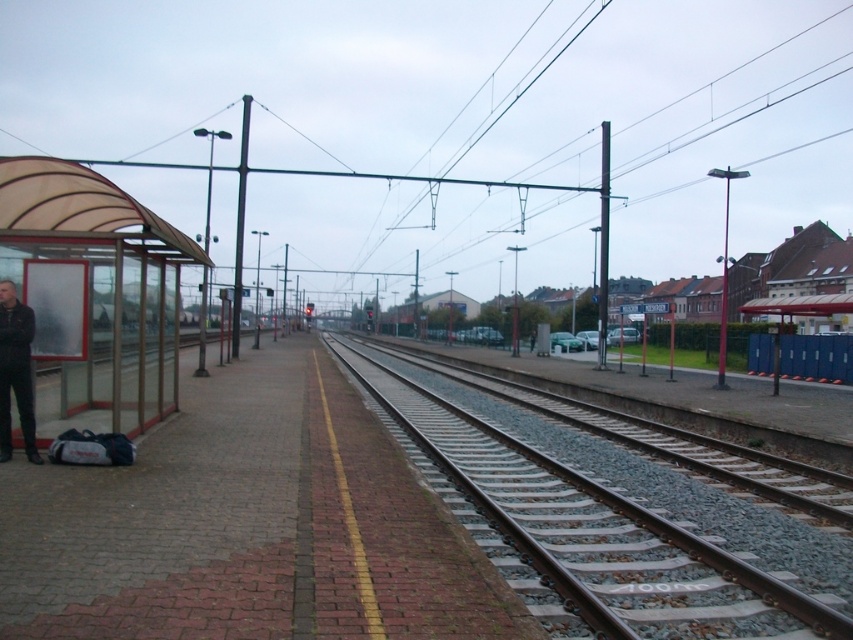
You are a commuter waiting at the station and need to board a train. You see the smooth metal tracks at center and the translucent plastic bus stop at left. Which object is closer to you?

The smooth metal tracks at center are closer to you than the translucent plastic bus stop at left because the tracks are shorter in distance compared to the bus stop.

You are a commuter waiting at the station and need to cross from the translucent plastic bus stop at left to the smooth metal tracks at center. Considering their sizes, which object is wider and would require more space to navigate around?

The translucent plastic bus stop at left is wider than the smooth metal tracks at center, so you would need more space to navigate around the translucent plastic bus stop at left.